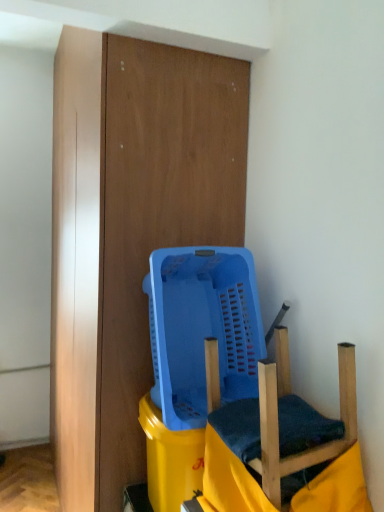
Question: Should I look upward or downward to see wooden swivel chair at lower right?

Choices:
 (A) down
 (B) up

Answer: (A)

Question: Can we say blue plastic basket at center lies outside wooden swivel chair at lower right?

Choices:
 (A) no
 (B) yes

Answer: (B)

Question: Considering the relative positions of blue plastic basket at center and wooden swivel chair at lower right in the image provided, is blue plastic basket at center in front of wooden swivel chair at lower right?

Choices:
 (A) yes
 (B) no

Answer: (B)

Question: Is blue plastic basket at center wider than wooden swivel chair at lower right?

Choices:
 (A) no
 (B) yes

Answer: (B)

Question: Is blue plastic basket at center taller than wooden swivel chair at lower right?

Choices:
 (A) yes
 (B) no

Answer: (A)

Question: From a real-world perspective, is blue plastic basket at center beneath wooden swivel chair at lower right?

Choices:
 (A) no
 (B) yes

Answer: (A)

Question: Does blue plastic basket at center appear on the left side of wooden swivel chair at lower right?

Choices:
 (A) yes
 (B) no

Answer: (A)

Question: Considering the relative sizes of wooden swivel chair at lower right and blue plastic basket at center in the image provided, is wooden swivel chair at lower right taller than blue plastic basket at center?

Choices:
 (A) no
 (B) yes

Answer: (A)

Question: Are wooden swivel chair at lower right and blue plastic basket at center making contact?

Choices:
 (A) yes
 (B) no

Answer: (B)

Question: Could you tell me if wooden swivel chair at lower right is facing blue plastic basket at center?

Choices:
 (A) no
 (B) yes

Answer: (A)

Question: Is wooden swivel chair at lower right at the left side of blue plastic basket at center?

Choices:
 (A) no
 (B) yes

Answer: (A)

Question: From the image's perspective, is wooden swivel chair at lower right located beneath blue plastic basket at center?

Choices:
 (A) yes
 (B) no

Answer: (A)

Question: Considering the relative sizes of wooden swivel chair at lower right and blue plastic basket at center in the image provided, is wooden swivel chair at lower right bigger than blue plastic basket at center?

Choices:
 (A) yes
 (B) no

Answer: (B)

Question: Considering their positions, is wooden swivel chair at lower right located in front of or behind blue plastic basket at center?

Choices:
 (A) behind
 (B) front

Answer: (B)